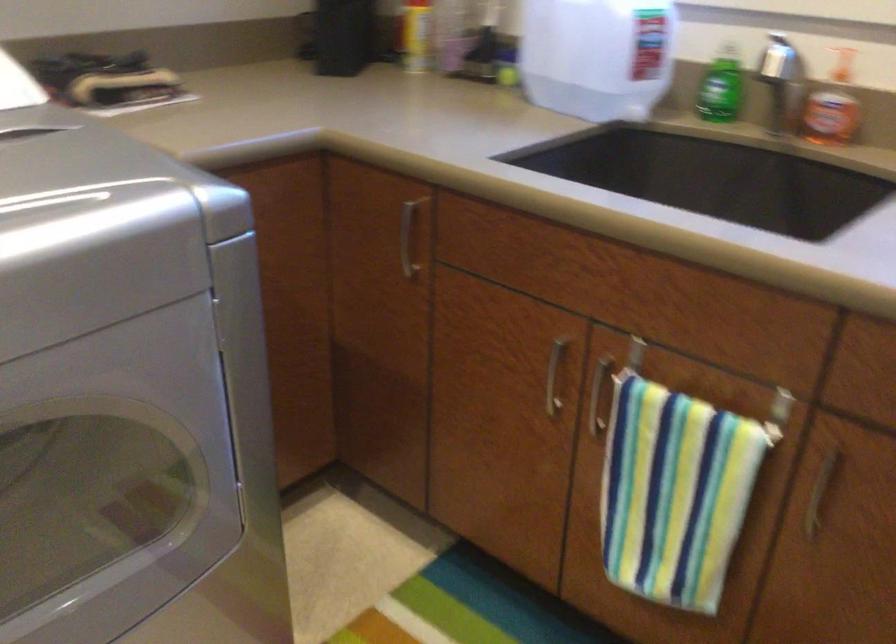
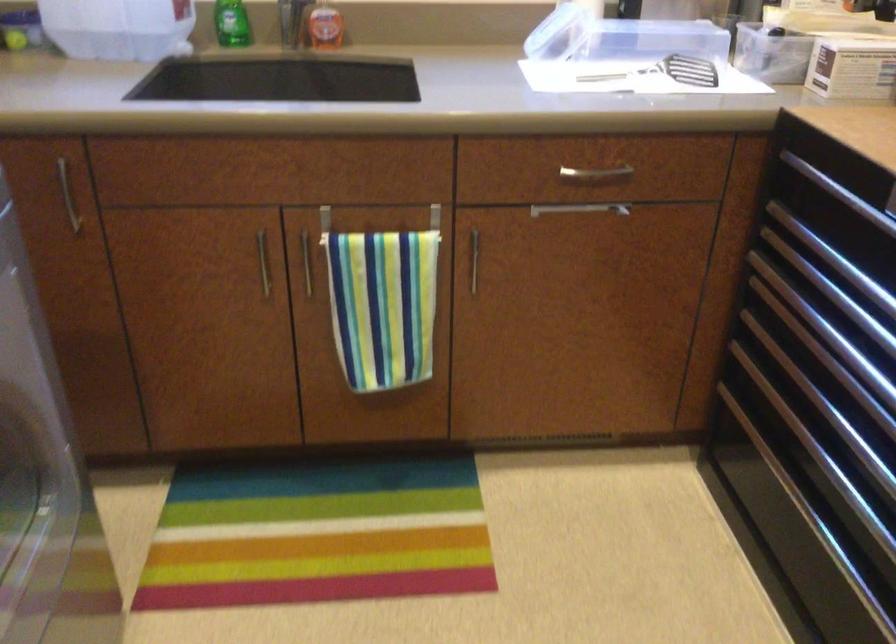
Question: The camera is either moving clockwise (left) or counter-clockwise (right) around the object. The first image is from the beginning of the video and the second image is from the end. Is the camera moving left or right when shooting the video?

Choices:
 (A) Left
 (B) Right

Answer: (A)